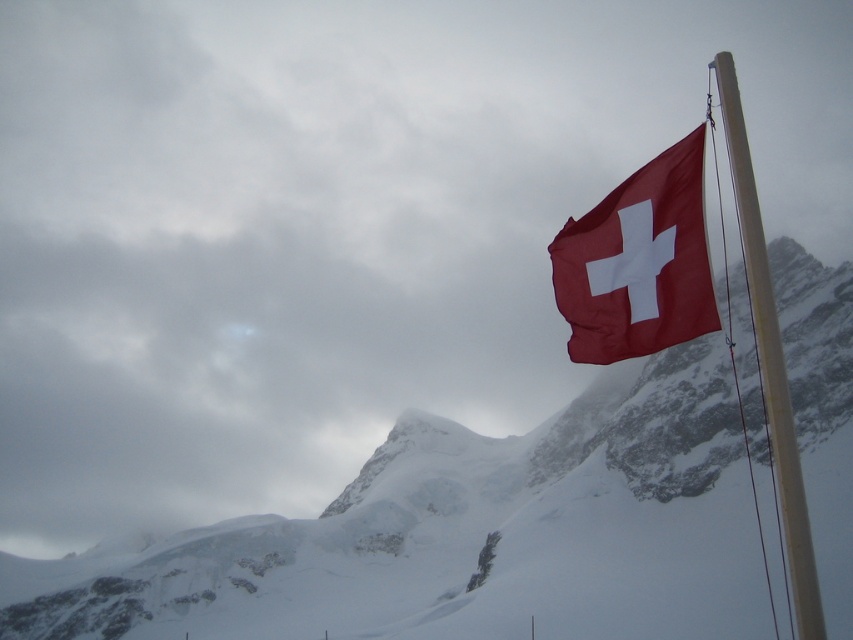
You are a photographer planning to take a photo of the Swiss flag in the snowy mountains. You notice the matte red flag at upper right and the white plastic flag pole at upper right. Which object should you focus on first if you want to capture the smaller one in detail?

The matte red flag at upper right is smaller than the white plastic flag pole at upper right, so you should focus on the matte red flag at upper right first to capture the smaller one in detail.

Looking at this image, you are a photographer trying to capture the Swiss flag against the mountain backdrop. You notice the snowy rock at upper right and the white plastic flag pole at upper right. Which object is taller in the image?

The snowy rock at upper right is taller than the white plastic flag pole at upper right according to the description.

You are a photographer positioned at the origin point of the image. You want to capture a shot where the matte red flag at upper right is centered in your viewfinder. Given the flag is at coordinates point0.411, 0.749, what direction should you move your camera to center it?

The matte red flag at upper right is located at point0.(x=637, y=639). To center it in your viewfinder, move your camera towards the upper right direction to align with the flag.